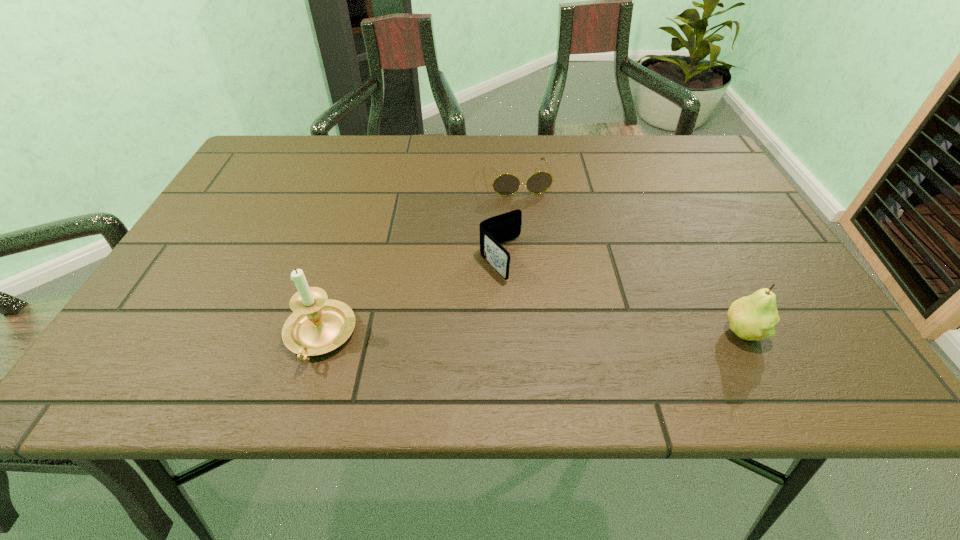
Image resolution: width=960 pixels, height=540 pixels. What are the coordinates of `vacant region located 0.180m on the outer surface of the third tallest object` in the screenshot? It's located at [569, 340].

The image size is (960, 540). I want to click on vacant space located 0.200m on the lenses of the farthest object, so click(x=540, y=249).

I want to click on blank space located 0.390m on the lenses of the farthest object, so click(561, 314).

Locate an element on the screen. This screenshot has height=540, width=960. vacant space located 0.230m on the lenses of the farthest object is located at coordinates (542, 258).

At what (x,y) coordinates should I click in order to perform the action: click on object that is at the far edge. Please return your answer as a coordinate pair (x, y). Looking at the image, I should click on (506, 184).

You are a GUI agent. You are given a task and a screenshot of the screen. Output one action in this format:
    pyautogui.click(x=<x>, y=<y>)
    Task: Click on the candle holder located at the near edge
    This screenshot has height=540, width=960.
    Given the screenshot: What is the action you would take?
    pyautogui.click(x=318, y=325)

Where is `pear that is at the near edge`? pear that is at the near edge is located at coordinates (753, 317).

Find the location of `object present at the right edge`. object present at the right edge is located at coordinates (753, 317).

Locate an element on the screen. The width and height of the screenshot is (960, 540). object that is at the near right corner is located at coordinates (753, 317).

Where is `vacant point at the far edge`? vacant point at the far edge is located at coordinates (480, 147).